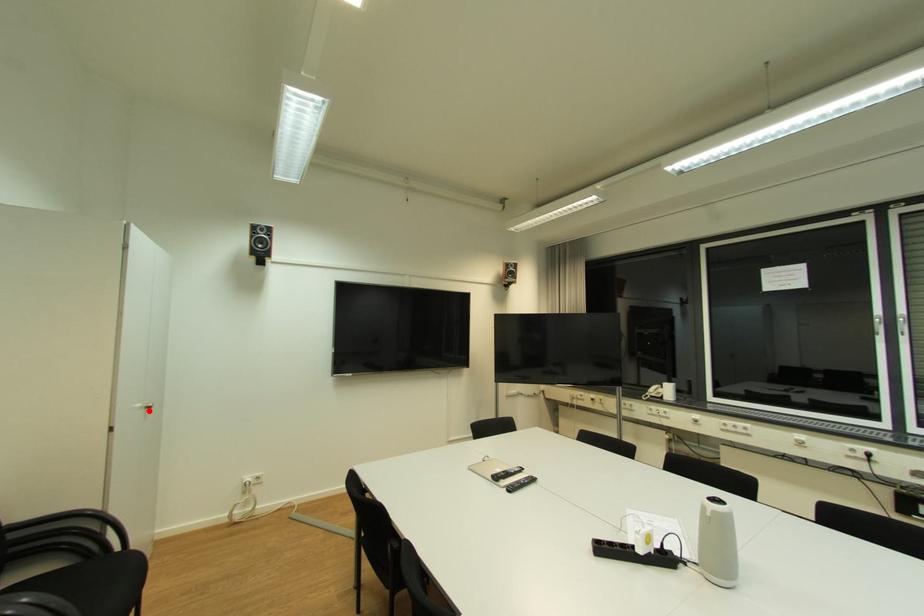
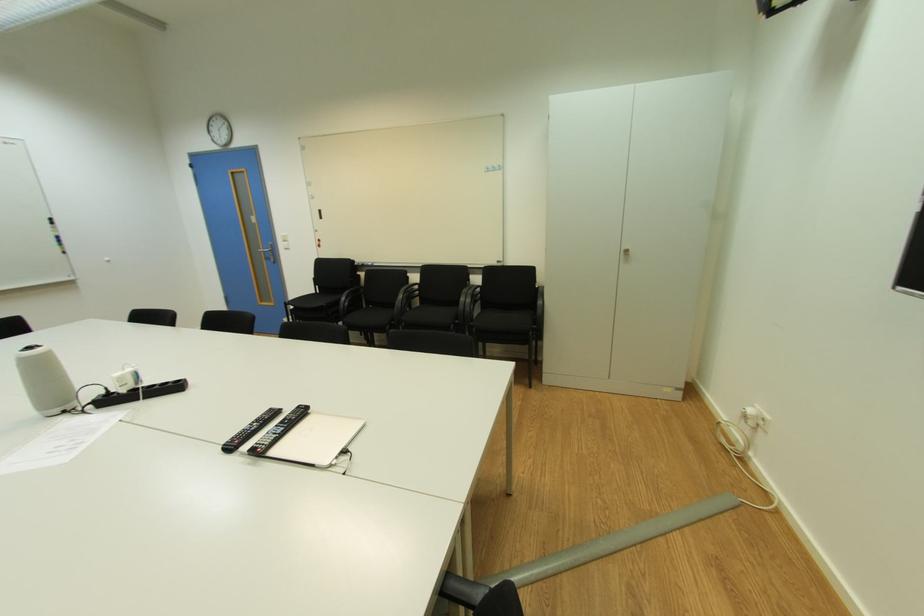
In the second image, find the point that corresponds to the highlighted location in the first image.

(628, 254)